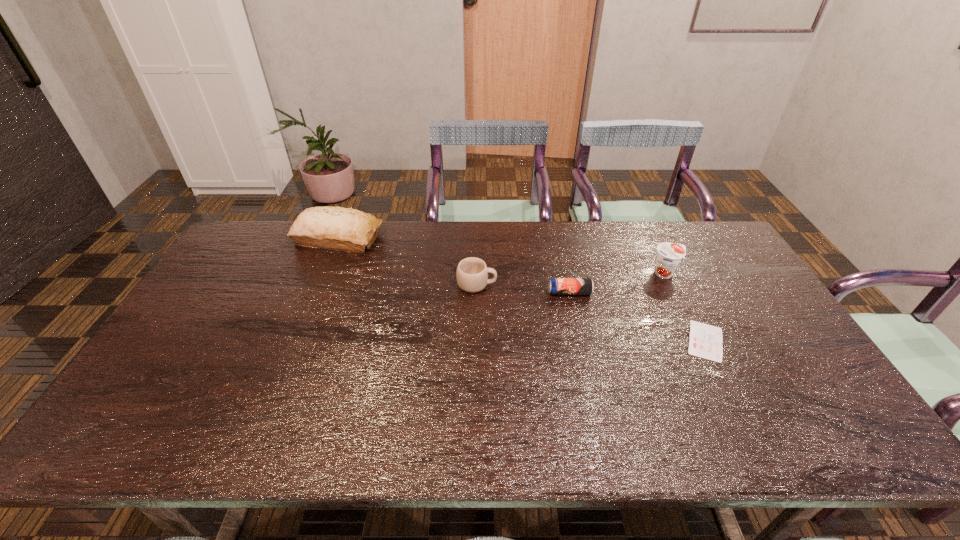
Identify the location of empty space that is in between the shortest object and the leftmost object. This screenshot has width=960, height=540. (522, 289).

You are a GUI agent. You are given a task and a screenshot of the screen. Output one action in this format:
    pyautogui.click(x=<x>, y=<y>)
    Task: Click on the free space between the fourth shortest object and the farthest object
    Image resolution: width=960 pixels, height=540 pixels.
    Given the screenshot: What is the action you would take?
    pyautogui.click(x=502, y=255)

The image size is (960, 540). I want to click on free point between the nearest object and the farthest object, so click(x=522, y=289).

The image size is (960, 540). I want to click on vacant area between the nearest object and the fourth shortest object, so click(685, 307).

You are a GUI agent. You are given a task and a screenshot of the screen. Output one action in this format:
    pyautogui.click(x=<x>, y=<y>)
    Task: Click on the free space that is in between the yogurt and the diary
    
    Given the screenshot: What is the action you would take?
    pyautogui.click(x=685, y=307)

Where is `empty space that is in between the bread and the second shortest object`? The width and height of the screenshot is (960, 540). empty space that is in between the bread and the second shortest object is located at coordinates (454, 265).

I want to click on vacant area that lies between the beer can and the diary, so click(637, 317).

Locate an element on the screen. The width and height of the screenshot is (960, 540). free space between the diary and the leftmost object is located at coordinates (522, 289).

You are a GUI agent. You are given a task and a screenshot of the screen. Output one action in this format:
    pyautogui.click(x=<x>, y=<y>)
    Task: Click on the vacant point located between the beer can and the yogurt
    
    Given the screenshot: What is the action you would take?
    [617, 283]

The height and width of the screenshot is (540, 960). I want to click on free space that is in between the bread and the fourth tallest object, so click(x=454, y=265).